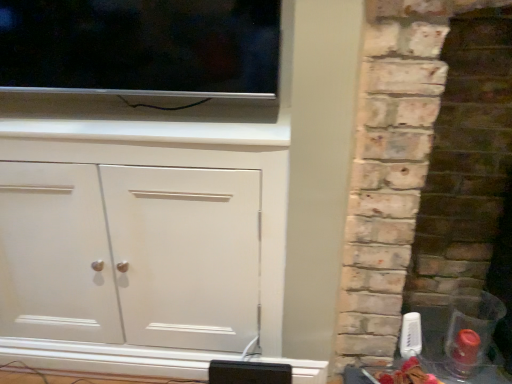
Question: From the image's perspective, is flat screen tv at upper left located above rustic stone fireplace at right?

Choices:
 (A) no
 (B) yes

Answer: (B)

Question: From the image's perspective, is flat screen tv at upper left under rustic stone fireplace at right?

Choices:
 (A) yes
 (B) no

Answer: (B)

Question: Considering the relative sizes of flat screen tv at upper left and rustic stone fireplace at right in the image provided, is flat screen tv at upper left smaller than rustic stone fireplace at right?

Choices:
 (A) yes
 (B) no

Answer: (A)

Question: Can you confirm if flat screen tv at upper left is bigger than rustic stone fireplace at right?

Choices:
 (A) yes
 (B) no

Answer: (B)

Question: Are flat screen tv at upper left and rustic stone fireplace at right beside each other?

Choices:
 (A) yes
 (B) no

Answer: (B)

Question: Is rustic stone fireplace at right inside or outside of white matte cabinet at center?

Choices:
 (A) outside
 (B) inside

Answer: (A)

Question: From the image's perspective, is rustic stone fireplace at right above or below white matte cabinet at center?

Choices:
 (A) above
 (B) below

Answer: (A)

Question: Looking at their shapes, would you say rustic stone fireplace at right is wider or thinner than white matte cabinet at center?

Choices:
 (A) wide
 (B) thin

Answer: (A)

Question: From a real-world perspective, is rustic stone fireplace at right positioned above or below white matte cabinet at center?

Choices:
 (A) below
 (B) above

Answer: (B)

Question: From the image's perspective, is flat screen tv at upper left above or below white matte cabinet at center?

Choices:
 (A) above
 (B) below

Answer: (A)

Question: Is point (30, 9) positioned closer to the camera than point (190, 268)?

Choices:
 (A) farther
 (B) closer

Answer: (B)

Question: From a real-world perspective, is flat screen tv at upper left physically located above or below white matte cabinet at center?

Choices:
 (A) above
 (B) below

Answer: (A)

Question: Which is correct: flat screen tv at upper left is inside white matte cabinet at center, or outside of it?

Choices:
 (A) inside
 (B) outside

Answer: (B)

Question: In terms of width, does rustic stone fireplace at right look wider or thinner when compared to flat screen tv at upper left?

Choices:
 (A) wide
 (B) thin

Answer: (A)

Question: From a real-world perspective, is rustic stone fireplace at right positioned above or below flat screen tv at upper left?

Choices:
 (A) below
 (B) above

Answer: (A)